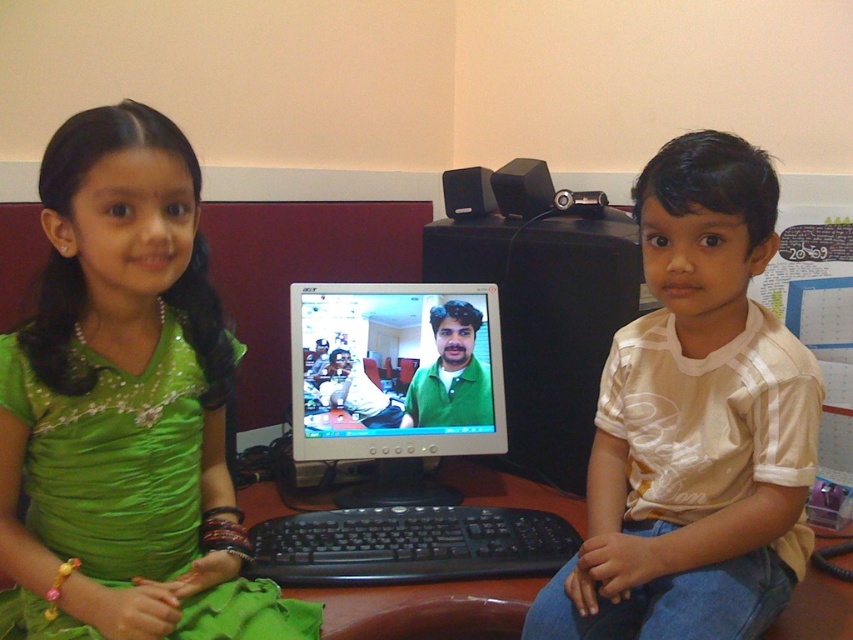
You are a photographer setting up a shoot in this classroom. You need to position a 1.2 meter tall backdrop behind the green satin dress at left and the brown wooden desk at center. Will the backdrop be tall enough to cover both objects?

The green satin dress at left is taller than the brown wooden desk at center. Since the backdrop is 1.2 meters tall, it will only be sufficient if both objects are shorter than 1.2 meters. However, since the dress is taller than the desk, but we don not have the exact height of the desk, we cannot definitively answer without more information.

Based on the scene described, can you determine the position of the green satin dress at left relative to the matte black monitor at center?

The green satin dress at left is positioned to the left of the matte black monitor at center.

You are setting up a new computer workstation and need to place the matte black monitor at center and the brown wooden desk at center in a specific arrangement. Given their sizes, which object should be placed closer to the wall to ensure both fit comfortably in the space?

The matte black monitor at center has a smaller size compared to the brown wooden desk at center, so the matte black monitor at center should be placed closer to the wall to allow space for the larger desk.